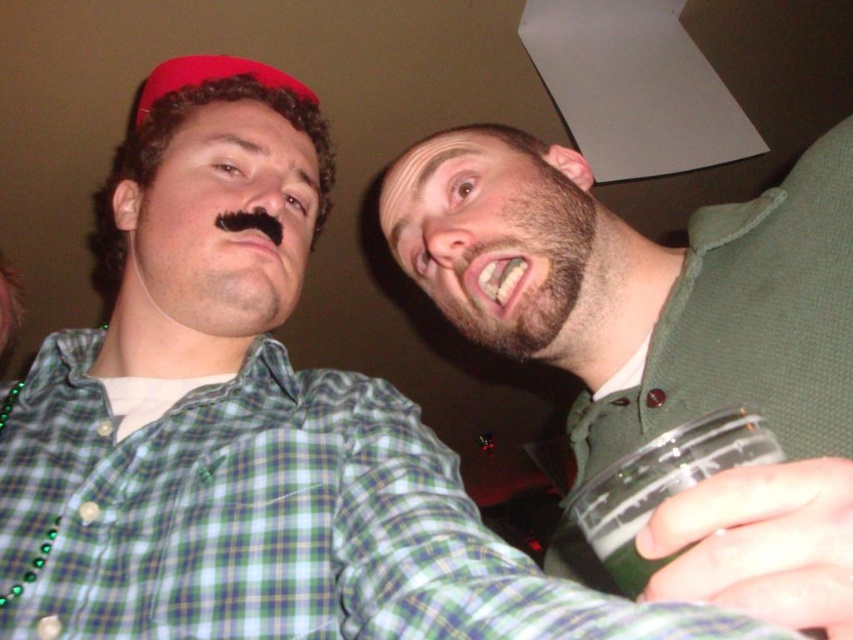
You are taking a photo of two people in an indoor setting. You want to focus on the person closer to the camera. Which of the two points, point (606, 432) or point (596, 525), should you adjust your camera focus to prioritize?

Point (606, 432) is further to the camera than point (596, 525), so you should focus on point (606, 432) to prioritize the person closer to the camera.

You are a bartender who needs to place a 10 inch long cocktail shaker between the dark brown stubble at upper right and the green frothy liquid at lower right. Can you fit it there?

The dark brown stubble at upper right is 10.08 inches from the green frothy liquid at lower right, so the 10 inch cocktail shaker can fit between them since the distance is slightly larger than the shaker.

You are standing in the bar and want to move from the point at coordinates point (608, 460) to the point at coordinates point (462, 320). Can you walk directly towards the second point without any obstacles?

Point (608, 460) is in front of point (462, 320). Therefore, walking directly from point (608, 460) to point (462, 320) would require moving backward, so there might be no obstacles in front of you, but you can walk directly towards the second point since the first point is already in front.